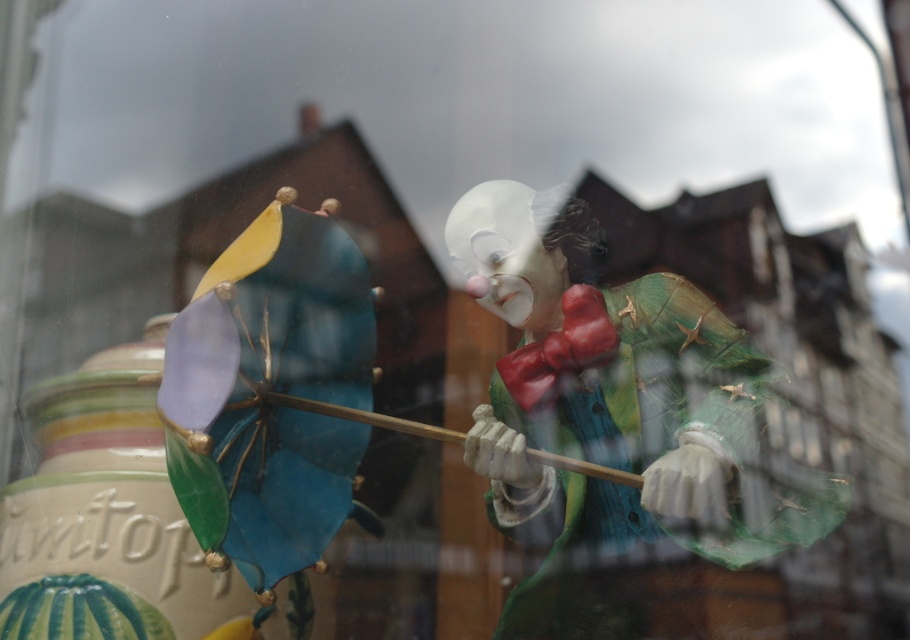
Can you confirm if matte porcelain clown at center is thinner than matte white clown nose at center?

Incorrect, matte porcelain clown at center's width is not less than matte white clown nose at center's.

Is matte porcelain clown at center positioned behind matte white clown nose at center?

No, matte porcelain clown at center is closer to the viewer.

The width and height of the screenshot is (910, 640). Identify the location of matte porcelain clown at center. (615, 417).